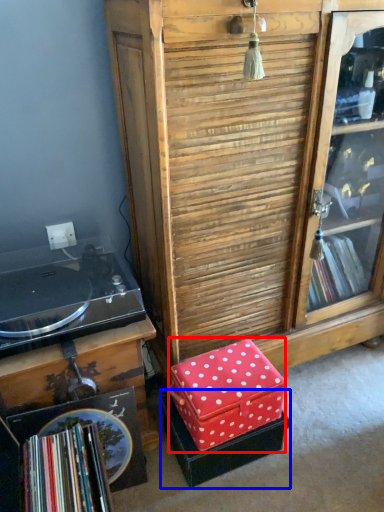
Question: Which point is further to the camera, storage box (highlighted by a red box) or storage box (highlighted by a blue box)?

Choices:
 (A) storage box
 (B) storage box

Answer: (B)